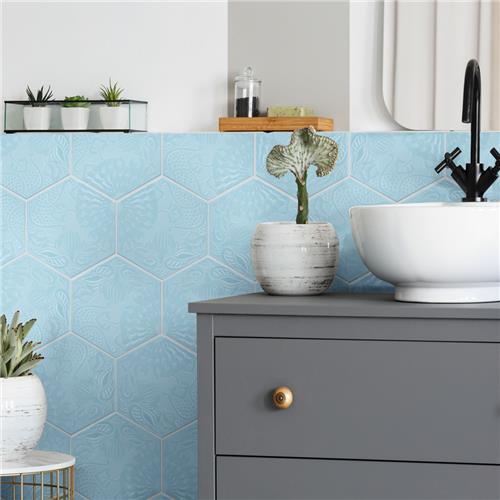
In order to click on sink in this screenshot , I will do `click(451, 241)`.